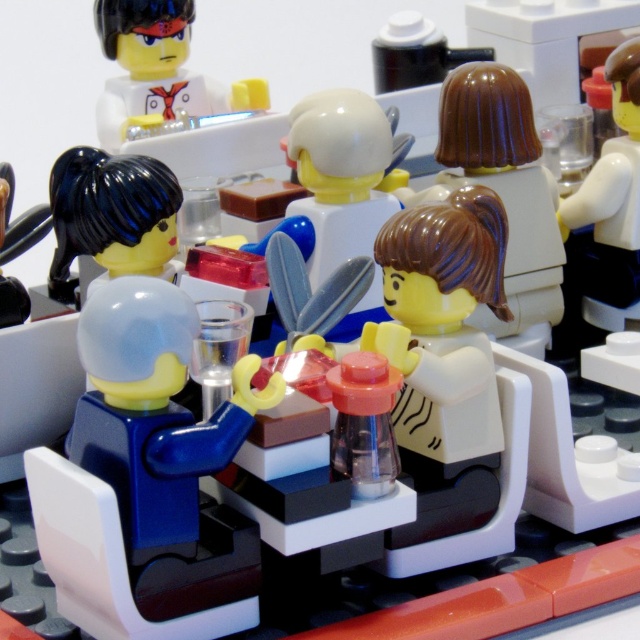
Question: In this image, where is blue matte figure at center located relative to matte white minifigure at upper left?

Choices:
 (A) left
 (B) right

Answer: (B)

Question: Which point is closer to the camera taking this photo?

Choices:
 (A) [x=570, y=209]
 (B) [x=157, y=456]
 (C) [x=529, y=212]
 (D) [x=99, y=244]

Answer: (B)

Question: Based on their relative distances, which object is farther from the brown glossy hair at center?

Choices:
 (A) white glossy cup at upper right
 (B) brown matte hair at upper center

Answer: (A)

Question: Which of the following is the farthest from the observer?

Choices:
 (A) white glossy cup at upper right
 (B) shiny black hair at left
 (C) brown matte hair at upper center
 (D) brown glossy hair at center

Answer: (A)

Question: Is brown matte hair at upper center wider than shiny black hair at left?

Choices:
 (A) yes
 (B) no

Answer: (B)

Question: Does blue matte figure at center appear on the right side of matte white minifigure at upper left?

Choices:
 (A) yes
 (B) no

Answer: (A)